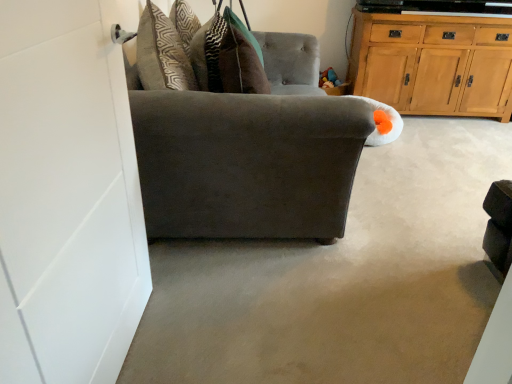
Question: Is suede gray chair at left in front of or behind wooden cabinet at upper right in the image?

Choices:
 (A) front
 (B) behind

Answer: (A)

Question: Is suede gray chair at left wider or thinner than wooden cabinet at upper right?

Choices:
 (A) wide
 (B) thin

Answer: (A)

Question: Which of these objects is positioned closest to the wooden cabinet at upper right?

Choices:
 (A) dark gray fabric couch at center
 (B) suede gray chair at left

Answer: (A)

Question: Estimate the real-world distances between objects in this image. Which object is closer to the wooden cabinet at upper right?

Choices:
 (A) dark gray fabric couch at center
 (B) suede gray chair at left

Answer: (A)